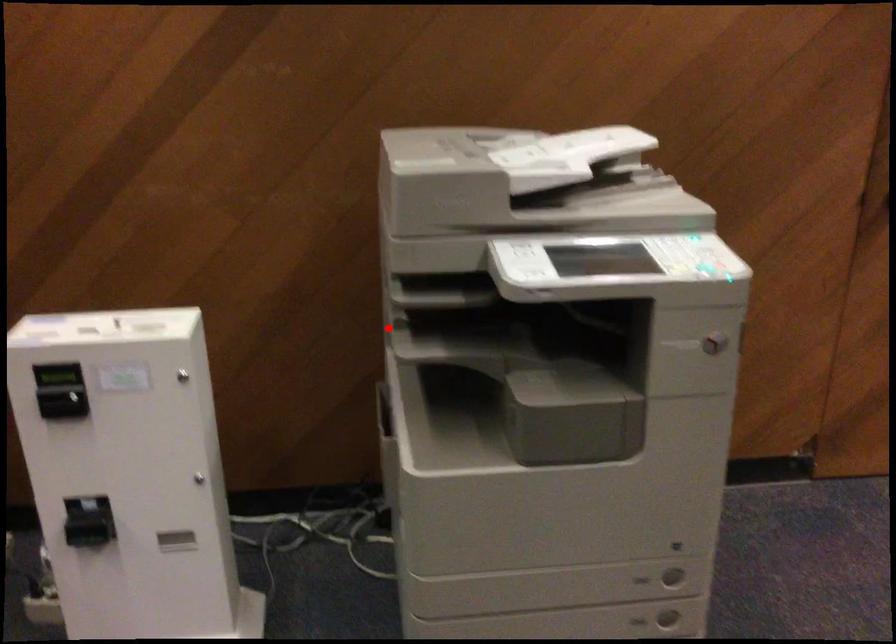
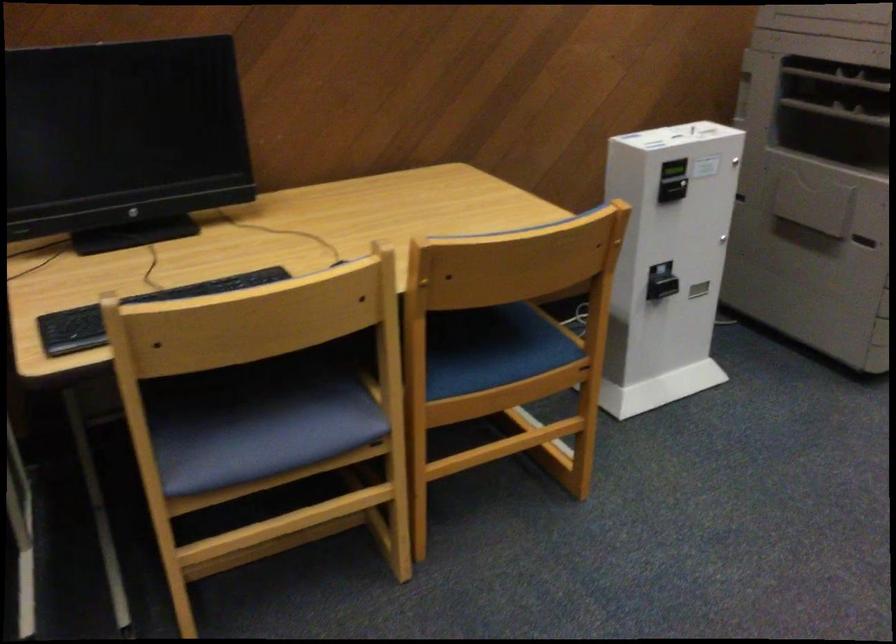
Where in the second image is the point corresponding to the highlighted location from the first image?

(836, 111)